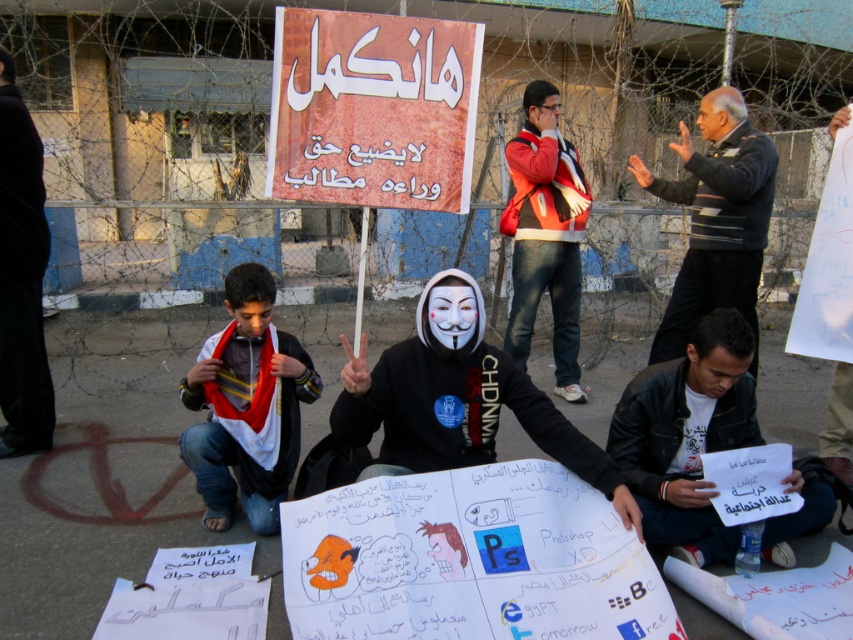
You are a photographer trying to capture a photo of both the leather jacket at lower right and the striped sweater at center in the same frame. Can you position yourself so that both are visible without moving either object? Explain your reasoning based on their distance.

Answer: The leather jacket at lower right and striped sweater at center are 3.62 feet apart. Since this distance is manageable within a typical camera frame, positioning yourself appropriately should allow both to be captured in the same photo without moving either object.

You are a photographer at the protest scene. You want to capture a photo that includes both the striped sweater at center and the black fabric pants at lower left. Which object should you focus on first to ensure both are in frame?

The striped sweater at center is shorter than the black fabric pants at lower left. To ensure both are in frame, focus on the black fabric pants at lower left first since it is taller and will require more vertical space.

You are a photographer at the protest scene. You want to take a photo that includes both the leather jacket at lower right and the striped sweater at center. Which object should be positioned to the left in your photo?

The leather jacket at lower right is to the left of the striped sweater at center, so in the photo, the leather jacket at lower right should be positioned to the left of the striped sweater at center.